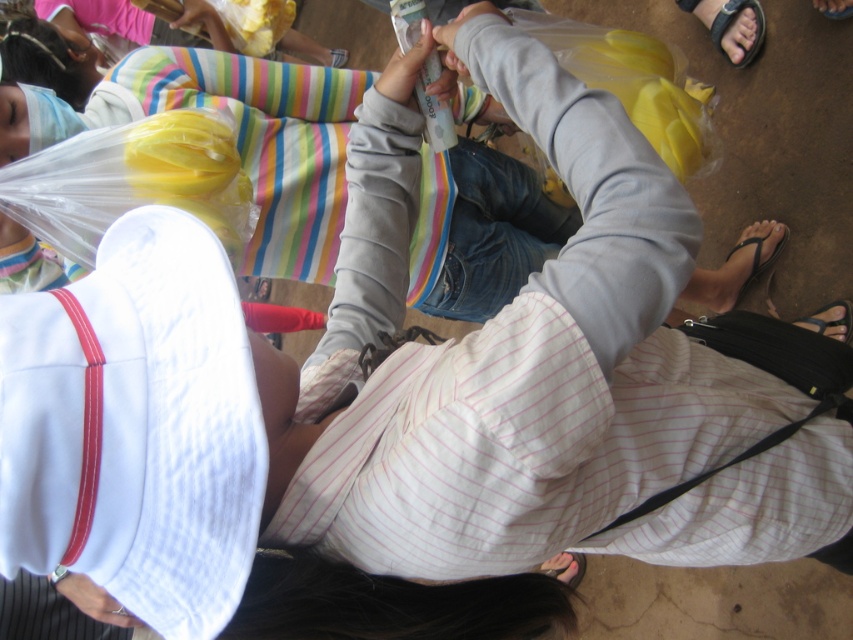
Question: Which point appears closest to the camera in this image?

Choices:
 (A) (155, 128)
 (B) (213, 13)

Answer: (A)

Question: Does smooth gray hoodie at center appear under matte plastic bag at upper center?

Choices:
 (A) yes
 (B) no

Answer: (A)

Question: Which point appears closest to the camera in this image?

Choices:
 (A) (218, 138)
 (B) (78, 576)

Answer: (B)

Question: Does smooth gray hoodie at center appear on the left side of matte plastic bag at upper center?

Choices:
 (A) no
 (B) yes

Answer: (A)

Question: Is smooth gray hoodie at center above white fabric at lower left?

Choices:
 (A) no
 (B) yes

Answer: (B)

Question: Among these points, which one is farthest from the camera?

Choices:
 (A) (136, 625)
 (B) (186, 28)
 (C) (386, 80)

Answer: (B)